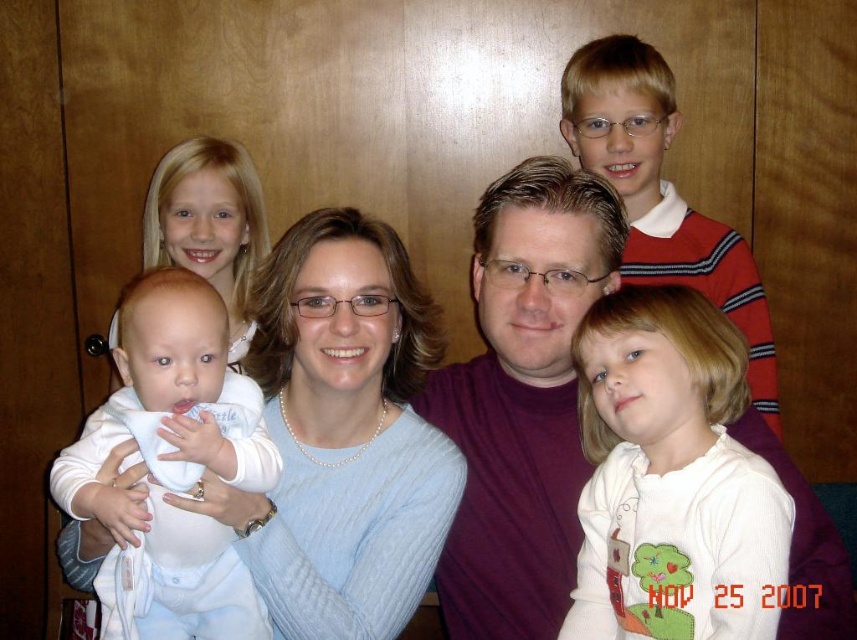
You are standing in front of the family portrait and want to know how far the point at coordinates (571,273) is from the camera. Can you determine the distance?

The point at coordinates (571,273) is 1.27 meters away from the camera.